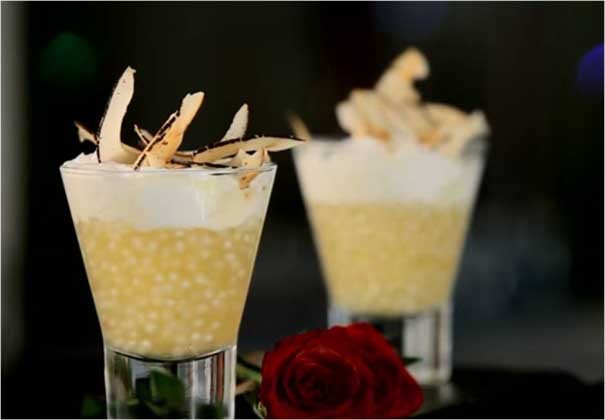
At what (x,y) coordinates should I click in order to perform the action: click on reflection in base of dessert glass. Please return your answer as a coordinate pair (x, y). Looking at the image, I should click on point(168,383).